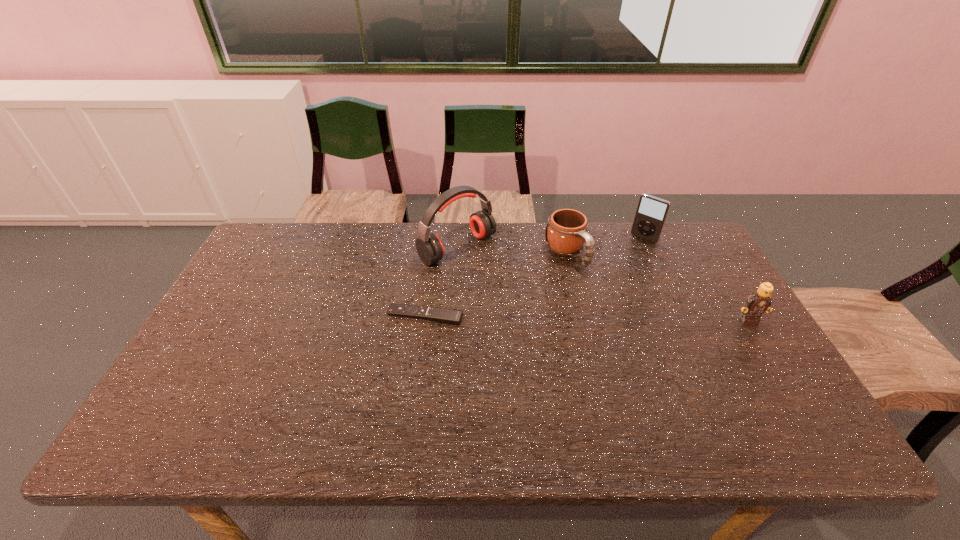
Find the location of `the shortest object`. the shortest object is located at coordinates (448, 316).

Locate an element on the screen. This screenshot has height=540, width=960. the rightmost object is located at coordinates (757, 303).

Image resolution: width=960 pixels, height=540 pixels. Find the location of `mug`. mug is located at coordinates (566, 233).

This screenshot has width=960, height=540. Find the location of `the second tallest object`. the second tallest object is located at coordinates (651, 213).

What are the coordinates of `iPod` in the screenshot? It's located at (651, 213).

Locate an element on the screen. the tallest object is located at coordinates (429, 247).

This screenshot has width=960, height=540. I want to click on free location located 0.230m on the back of the shortest object, so click(432, 255).

I want to click on vacant space located in front of the rightmost object, so click(798, 400).

You are a GUI agent. You are given a task and a screenshot of the screen. Output one action in this format:
    pyautogui.click(x=<x>, y=<y>)
    Task: Click on the vacant position located on the side of the third object from left to right with the handle
    
    Given the screenshot: What is the action you would take?
    pyautogui.click(x=622, y=315)

Find the location of a particular element. The image size is (960, 540). vacant space located 0.340m on the side of the third object from left to right with the handle is located at coordinates (655, 348).